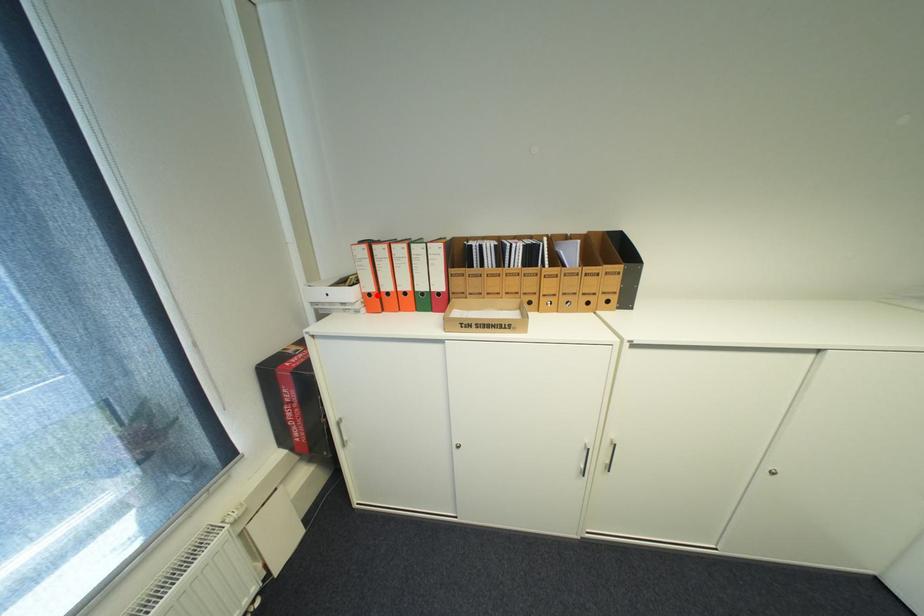
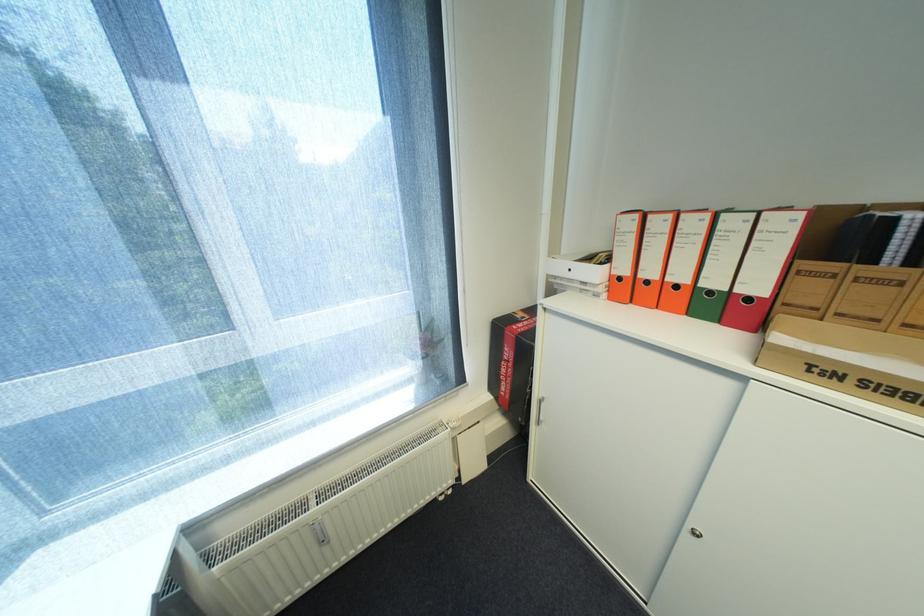
Locate, in the second image, the point that corresponds to the highlighted location in the first image.

(627, 278)